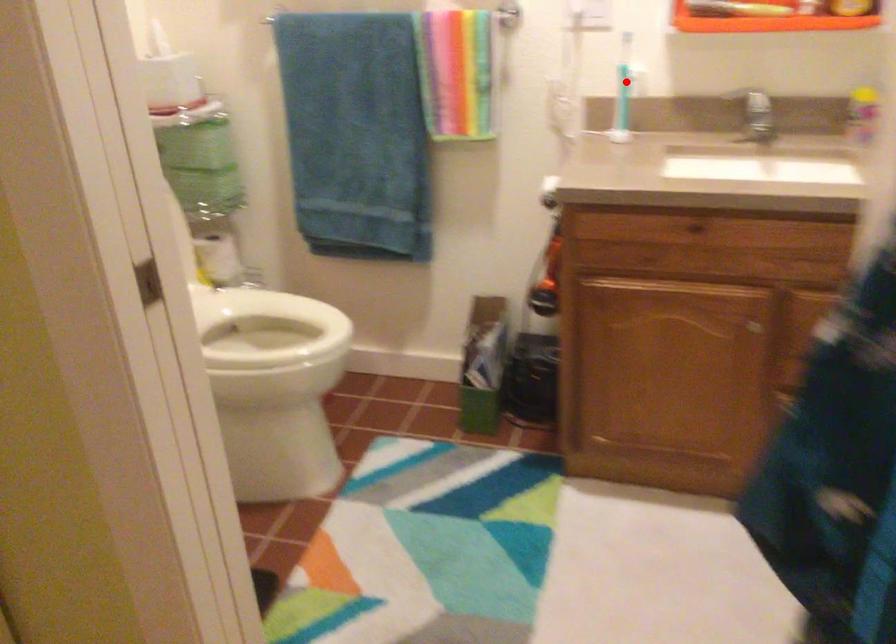
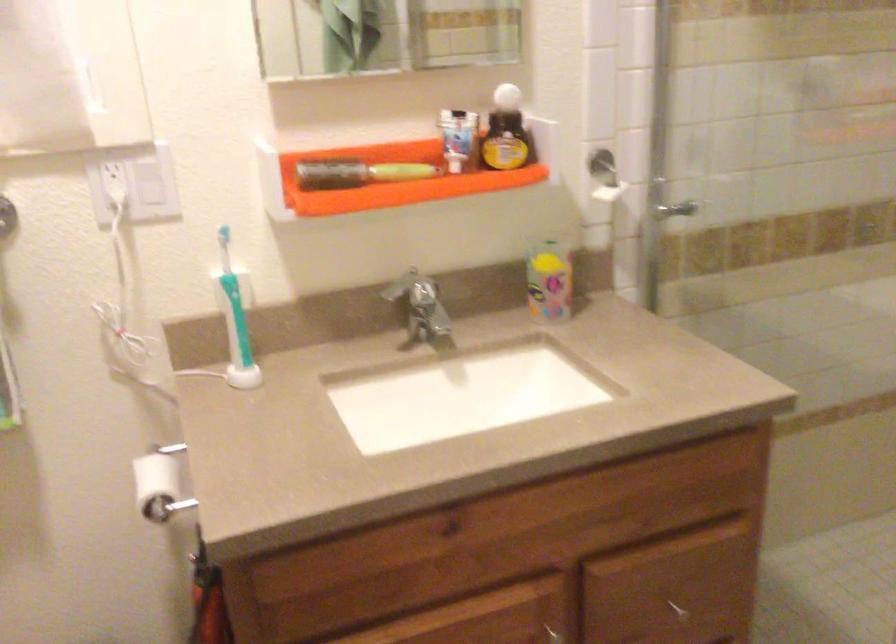
Question: I am providing you with two images of the same scene from different viewpoints. Image1 has a red point marked. In image2, the corresponding 3D location appears at what relative position? Reply with the corresponding letter.

Choices:
 (A) Closer
 (B) Farther

Answer: (A)